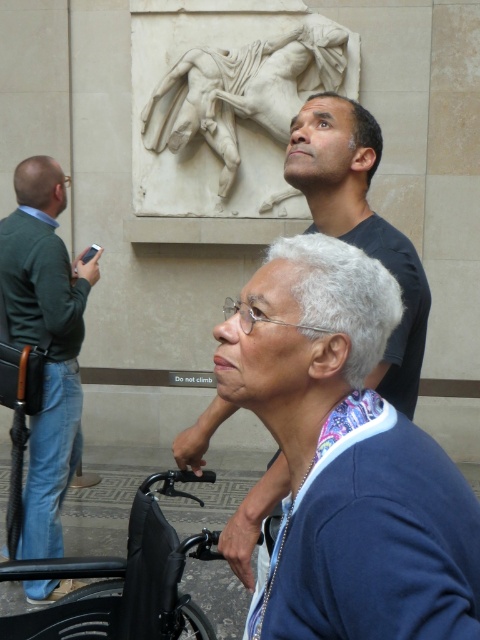
Which of these two, black matte shirt at upper center or white marble relief at upper center, stands shorter?

With less height is black matte shirt at upper center.

Who is lower down, black matte shirt at upper center or white marble relief at upper center?

black matte shirt at upper center

Between point (415, 269) and point (216, 129), which one is positioned in front?

Positioned in front is point (415, 269).

Where is `black matte shirt at upper center`? The image size is (480, 640). black matte shirt at upper center is located at coordinates (360, 224).

Between point (386, 394) and point (56, 577), which one is positioned behind?

Positioned behind is point (56, 577).

The height and width of the screenshot is (640, 480). In order to click on black matte shirt at upper center in this screenshot , I will do `click(360, 224)`.

In the scene shown: Which is more to the right, green sweater at left or white marble relief at upper center?

white marble relief at upper center

Does green sweater at left have a lesser width compared to white marble relief at upper center?

Correct, green sweater at left's width is less than white marble relief at upper center's.

Does point (22, 234) come closer to viewer compared to point (228, 61)?

Yes, it is in front of point (228, 61).

I want to click on green sweater at left, so click(49, 342).